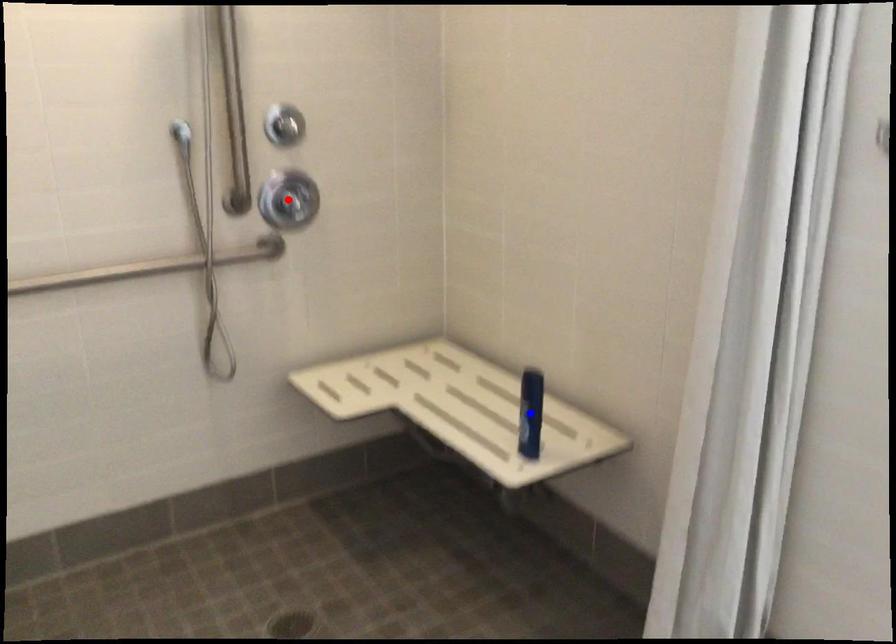
Question: In the image, two points are highlighted. Which point is nearer to the camera? Reply with the corresponding letter.

Choices:
 (A) blue point
 (B) red point

Answer: (A)